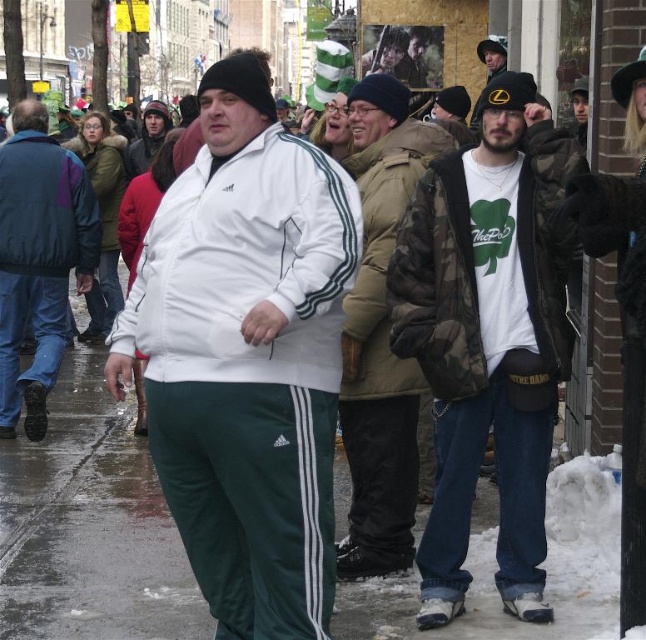
Is point (271, 385) in front of point (543, 240)?

Yes, point (271, 385) is in front of point (543, 240).

Who is higher up, white matte tracksuit at center or camo jacket at center?

camo jacket at center

I want to click on white matte tracksuit at center, so click(x=245, y=356).

Does point (419, 525) come farther from viewer compared to point (94, 248)?

No, (419, 525) is closer to viewer.

Does green track pants at center have a lesser width compared to dark blue and green quilted jacket at left?

No.

Locate an element on the screen. Image resolution: width=646 pixels, height=640 pixels. green track pants at center is located at coordinates (89, 525).

Is matte white jacket at center further to the viewer compared to camouflage jacket at center?

That is True.

Which of these two, matte white jacket at center or camouflage jacket at center, stands taller?

matte white jacket at center is taller.

The height and width of the screenshot is (640, 646). Identify the location of matte white jacket at center. tap(37, 259).

Where is `matte white jacket at center`? matte white jacket at center is located at coordinates (37, 259).